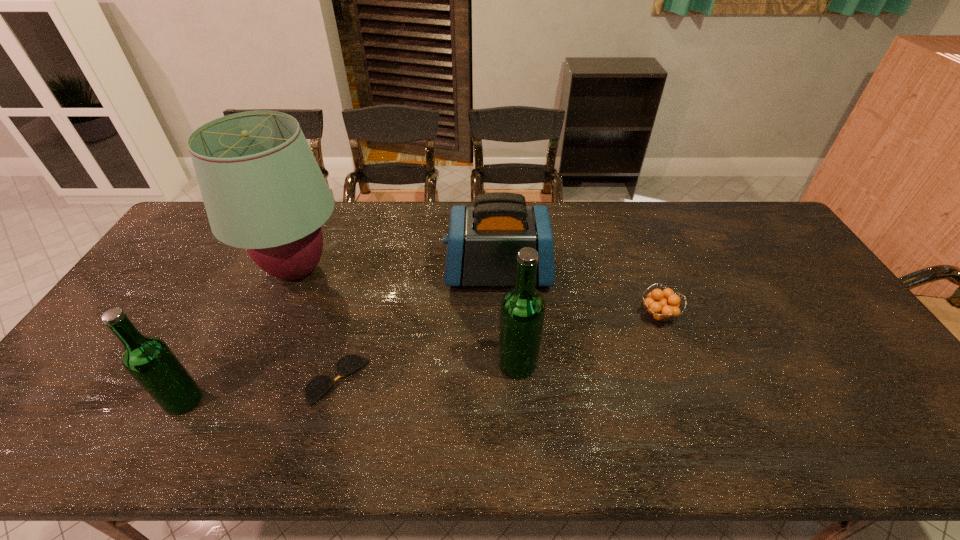
Given the evenly spaced beer bottles in the image, where should an extra beer bottle be added on the right to preserve the spacing? Please point to a vacant space. Please provide its 2D coordinates. Your answer should be formatted as a tuple, i.e. [(x, y)], where the tuple contains the x and y coordinates of a point satisfying the conditions above.

[(809, 332)]